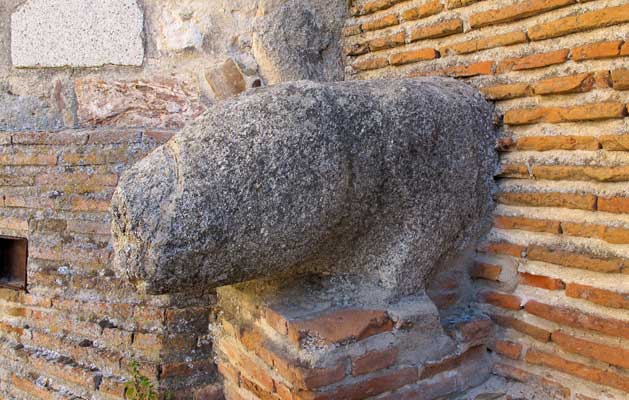
Locate an element on the screen. wall is located at coordinates (160, 17), (155, 54), (6, 20).